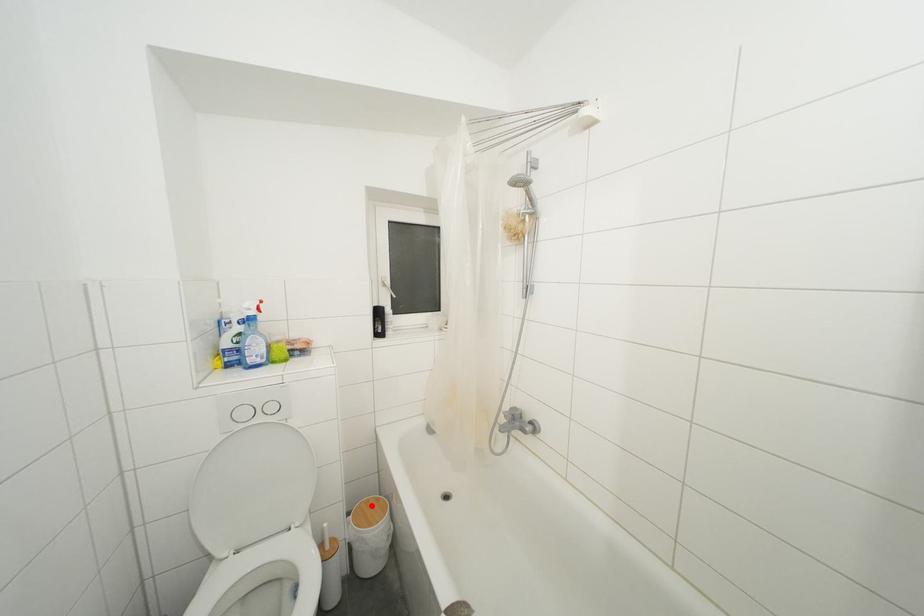
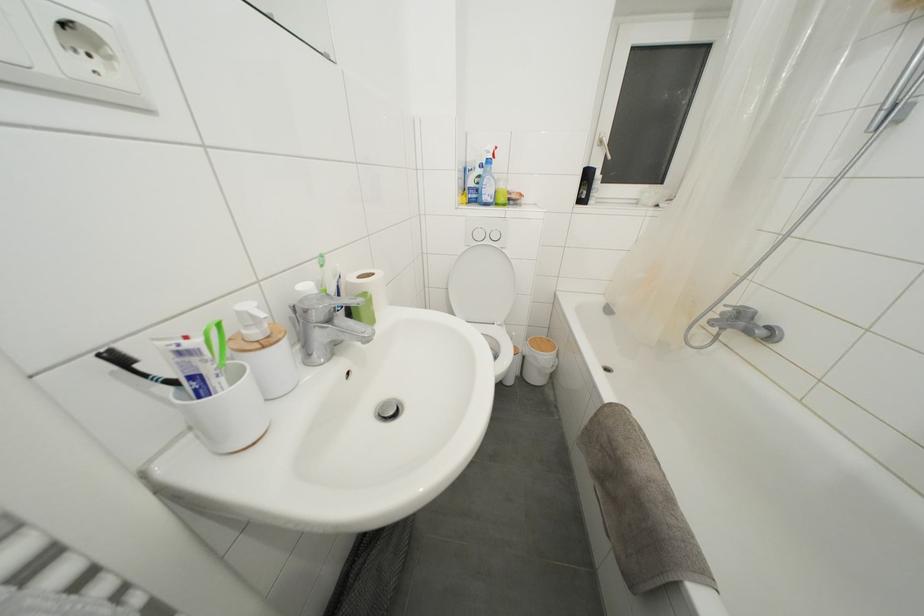
Question: I am providing you with two images of the same scene from different viewpoints. Image1 has a red point marked. In image2, the corresponding 3D location appears at what relative position? Reply with the corresponding letter.

Choices:
 (A) Closer
 (B) Farther

Answer: (B)